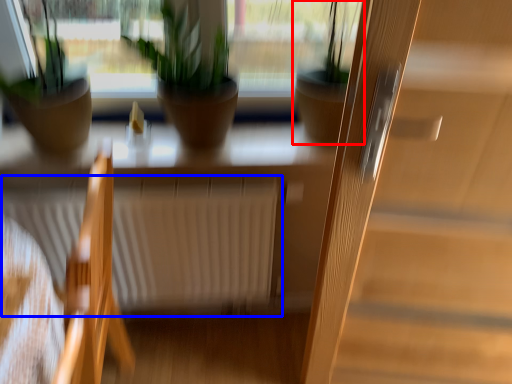
Question: Which point is further to the camera, houseplant (highlighted by a red box) or radiator (highlighted by a blue box)?

Choices:
 (A) houseplant
 (B) radiator

Answer: (B)